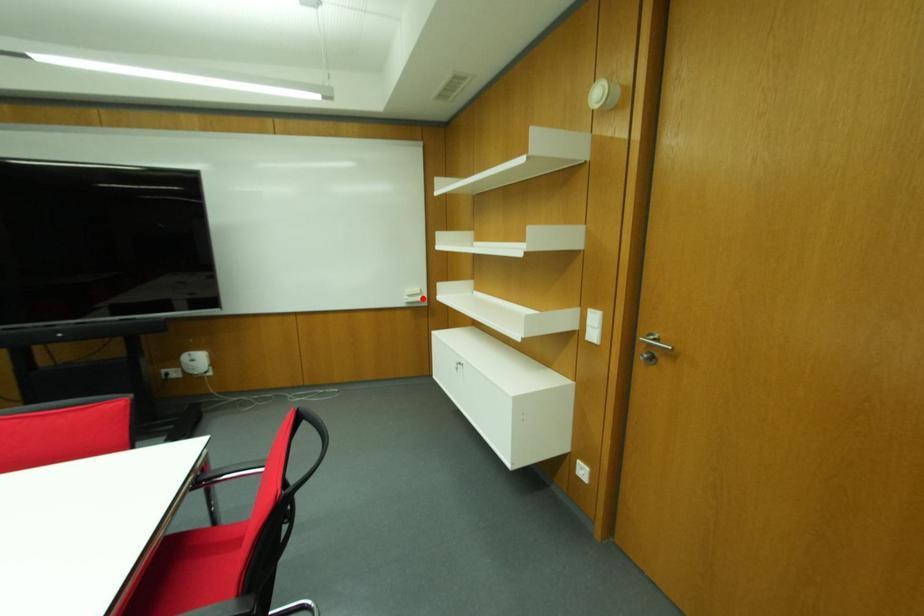
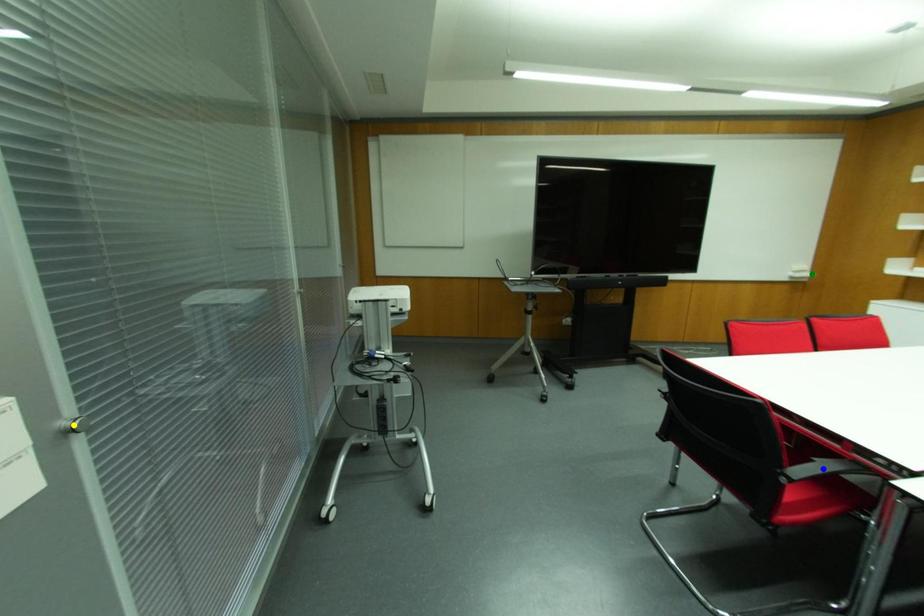
Question: I am providing you with two images of the same scene from different viewpoints. A red point is marked on the first image. You are given multiple points on the second image. Can you choose the point in image 2 that corresponds to the point in image 1?

Choices:
 (A) green point
 (B) blue point
 (C) yellow point

Answer: (A)